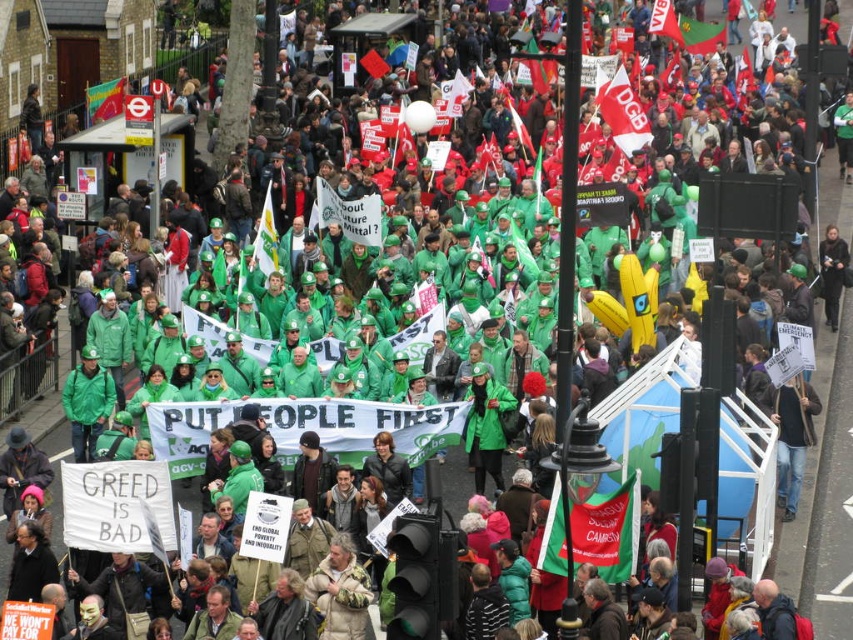
Is white fabric flag at center wider than green fabric flag at upper center?

Yes.

Does white fabric flag at center have a larger size compared to green fabric flag at upper center?

Yes.

Where is `white fabric flag at center`? white fabric flag at center is located at coordinates (265, 237).

Who is positioned more to the left, red fabric flag at upper center or green fabric flag at upper center?

red fabric flag at upper center

Does red fabric flag at upper center appear under green fabric flag at upper center?

Yes.

Is point (616, 76) positioned before point (651, 26)?

Yes, it is in front of point (651, 26).

Where is `red fabric flag at upper center`? This screenshot has width=853, height=640. red fabric flag at upper center is located at coordinates (621, 112).

Is point (630, 144) positioned before point (264, 244)?

No, it is not.

Does red fabric flag at upper center appear under white fabric flag at center?

Actually, red fabric flag at upper center is above white fabric flag at center.

The height and width of the screenshot is (640, 853). What do you see at coordinates (621, 112) in the screenshot? I see `red fabric flag at upper center` at bounding box center [621, 112].

Where is `red fabric flag at upper center`? This screenshot has width=853, height=640. red fabric flag at upper center is located at coordinates (621, 112).